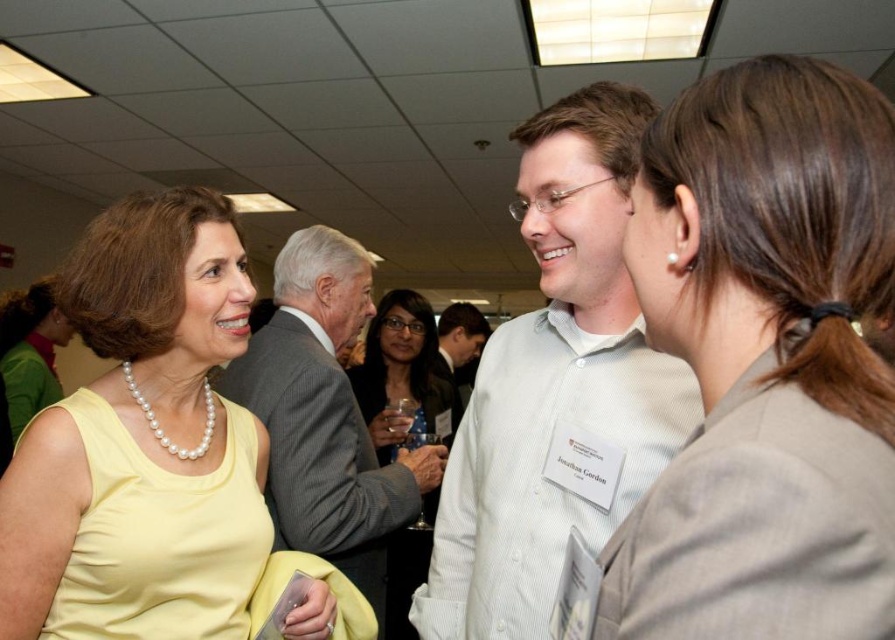
You are standing at the entrance of the event and see the yellow fabric dress at left and the matte black dress at center. If you want to greet both people wearing these dresses, which one should you approach first to minimize the distance walked?

The yellow fabric dress at left is closer to you since it is only 39.04 inches away from the matte black dress at center. Therefore, you should approach the yellow fabric dress at left first to minimize the distance walked.

In the scene shown: You are attending an event and see a woman wearing a matte black dress at center and a person with brown hair at upper right. Which of these two is located to the right side of the other?

The brown hair at upper right is positioned on the right side of matte black dress at center.